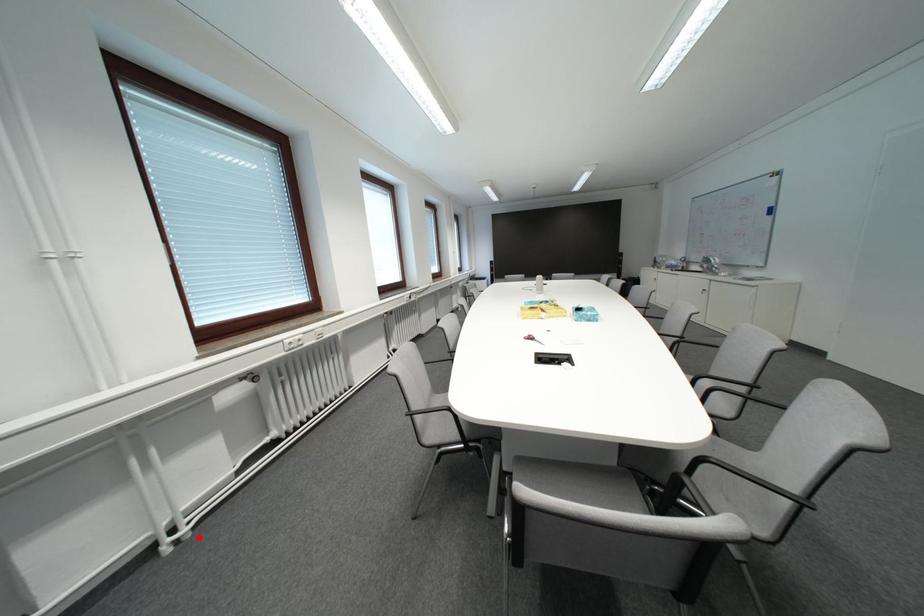
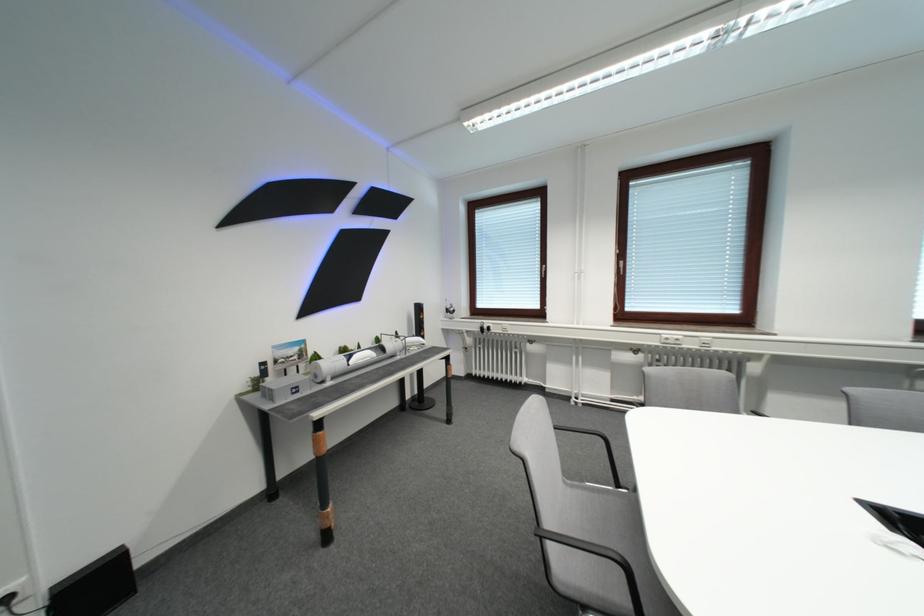
Question: I am providing you with two images of the same scene from different viewpoints. Image1 has a red point marked. In image2, the corresponding 3D location appears at what relative position? Reply with the corresponding letter.

Choices:
 (A) Closer
 (B) Farther

Answer: (B)